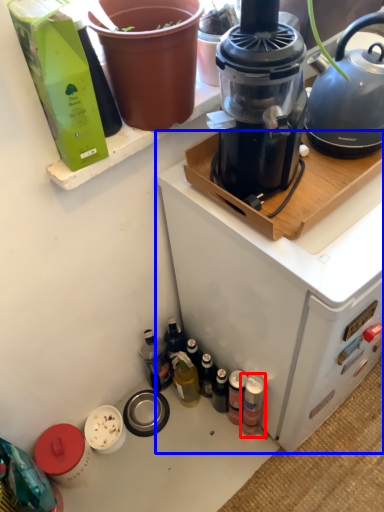
Question: Which object is closer to the camera taking this photo, bottle (highlighted by a red box) or appliance (highlighted by a blue box)?

Choices:
 (A) bottle
 (B) appliance

Answer: (B)